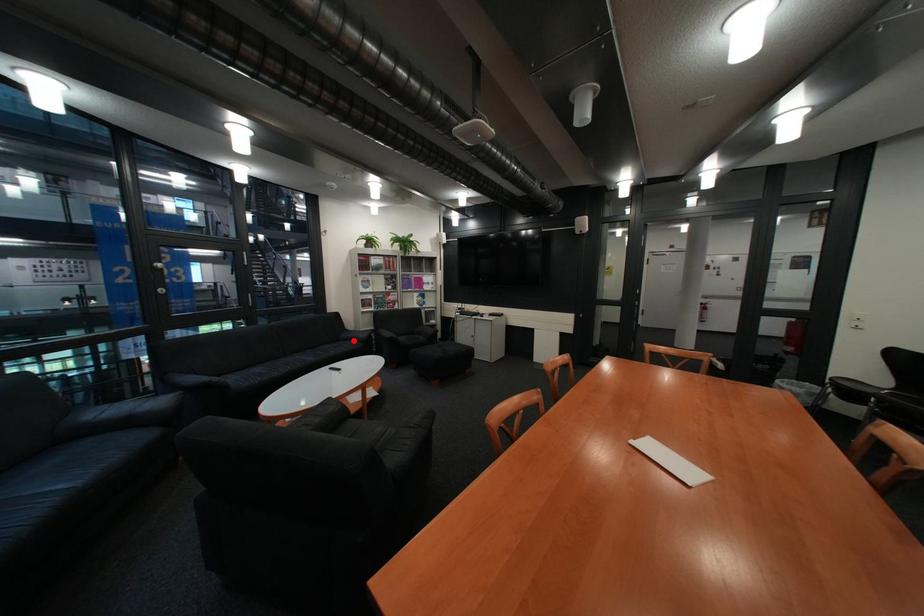
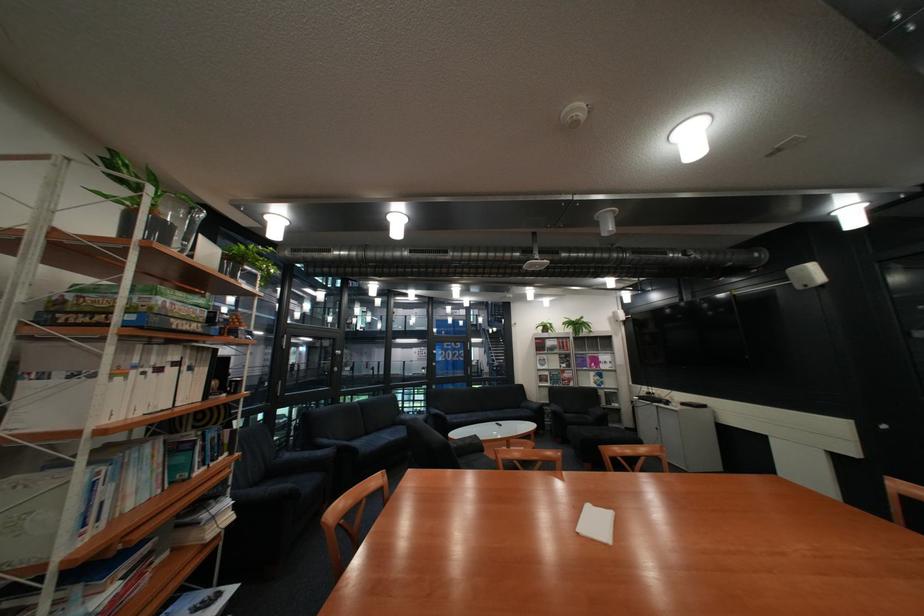
Question: I am providing you with two images of the same scene from different viewpoints. Given a red point in image1, look at the same physical point in image2. Is it:

Choices:
 (A) Closer to the viewpoint
 (B) Farther from the viewpoint

Answer: (B)